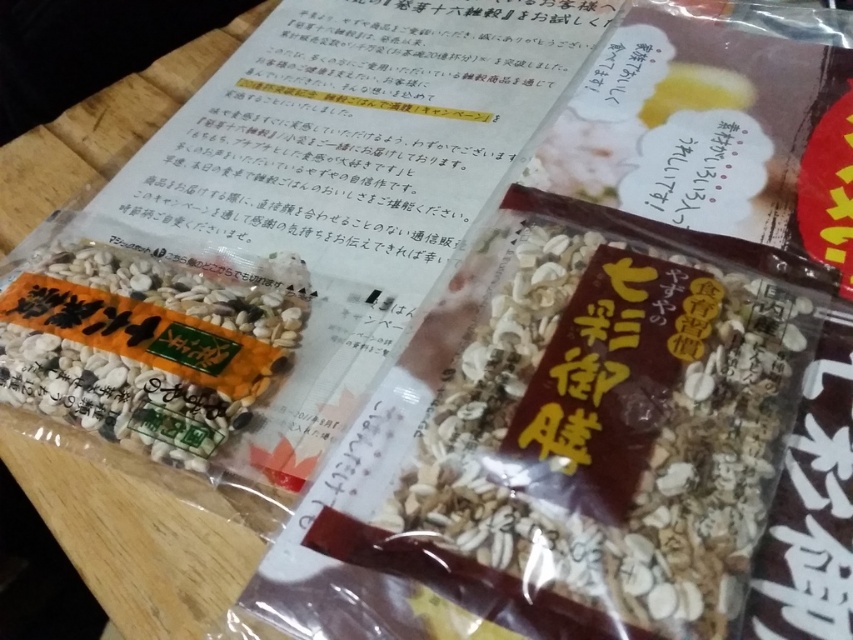
Question: Can you confirm if brown matte granola at center is positioned above white matte seeds at center?

Choices:
 (A) no
 (B) yes

Answer: (A)

Question: Can you confirm if brown matte granola at center is bigger than white matte seeds at center?

Choices:
 (A) no
 (B) yes

Answer: (B)

Question: Among these objects, which one is farthest from the camera?

Choices:
 (A) brown matte granola at center
 (B) white matte seeds at center

Answer: (B)

Question: Which point is farther from the camera taking this photo?

Choices:
 (A) (48, 307)
 (B) (631, 493)

Answer: (A)

Question: Is brown matte granola at center thinner than white matte seeds at center?

Choices:
 (A) no
 (B) yes

Answer: (A)